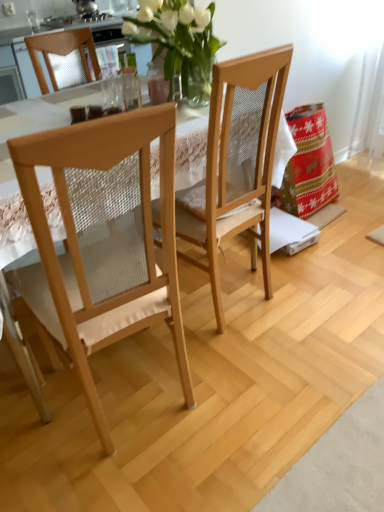
At what (x,y) coordinates should I click in order to perform the action: click on vacant area in front of light wood/mesh chair at left, the 2th chair when ordered from right to left. Please return your answer as a coordinate pair (x, y). Looking at the image, I should click on (126, 474).